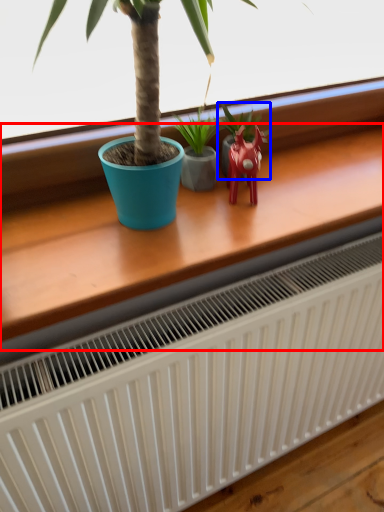
Question: Which object is further to the camera taking this photo, table (highlighted by a red box) or houseplant (highlighted by a blue box)?

Choices:
 (A) table
 (B) houseplant

Answer: (B)